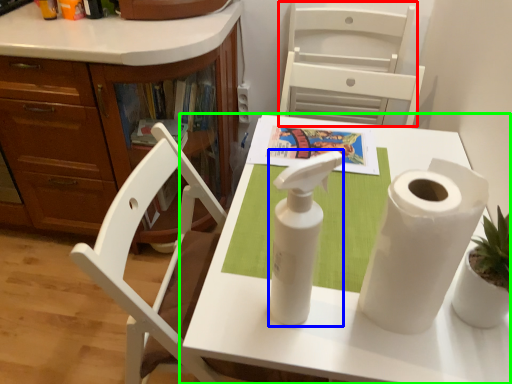
Question: Estimate the real-world distances between objects in this image. Which object is closer to armchair (highlighted by a red box), soap dispenser (highlighted by a blue box) or table (highlighted by a green box)?

Choices:
 (A) soap dispenser
 (B) table

Answer: (B)